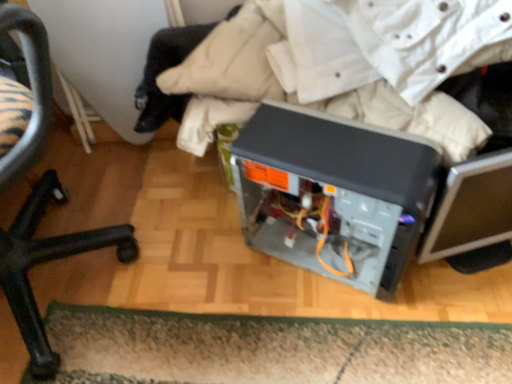
The width and height of the screenshot is (512, 384). Find the location of `black plastic chair at lower left`. black plastic chair at lower left is located at coordinates (47, 261).

Is point (473, 348) closer or farther from the camera than point (28, 215)?

Clearly, point (473, 348) is closer to the camera than point (28, 215).

Is green shaggy doormat at lower center not inside black plastic chair at lower left?

Yes, green shaggy doormat at lower center is outside of black plastic chair at lower left.

Are green shaggy doormat at lower center and black plastic chair at lower left located far from each other?

Actually, green shaggy doormat at lower center and black plastic chair at lower left are a little close together.

How many degrees apart are the facing directions of green shaggy doormat at lower center and black plastic chair at lower left?

The angle between the facing direction of green shaggy doormat at lower center and the facing direction of black plastic chair at lower left is 21.3 degrees.

Between black plastic chair at lower left and satin black computer case at center, which one has smaller width?

satin black computer case at center.

Is black plastic chair at lower left further to camera compared to satin black computer case at center?

No, black plastic chair at lower left is closer to the viewer.

Is black plastic chair at lower left taller or shorter than satin black computer case at center?

black plastic chair at lower left is taller than satin black computer case at center.

Looking at this image, between satin black computer case at center and black plastic chair at lower left, which one appears on the right side from the viewer's perspective?

satin black computer case at center.

Between satin black computer case at center and black plastic chair at lower left, which one is positioned in front?

black plastic chair at lower left is closer to the camera.

From a real-world perspective, is satin black computer case at center under black plastic chair at lower left?

Yes.

Based on the photo, is black plastic chair at lower left positioned beyond the bounds of green shaggy doormat at lower center?

Absolutely, black plastic chair at lower left is external to green shaggy doormat at lower center.

From the image's perspective, relative to green shaggy doormat at lower center, is black plastic chair at lower left above or below?

Based on their image positions, black plastic chair at lower left is located above green shaggy doormat at lower center.

Locate an element on the screen. Image resolution: width=512 pixels, height=384 pixels. chair located above the green shaggy doormat at lower center (from a real-world perspective) is located at coordinates (47, 261).

Would you say green shaggy doormat at lower center contains satin black computer case at center?

That's incorrect, satin black computer case at center is not inside green shaggy doormat at lower center.

Find the location of `wide in front of the green shaggy doormat at lower center`. wide in front of the green shaggy doormat at lower center is located at coordinates (337, 189).

Who is bigger, green shaggy doormat at lower center or satin black computer case at center?

With larger size is satin black computer case at center.

Considering the relative sizes of green shaggy doormat at lower center and satin black computer case at center in the image provided, is green shaggy doormat at lower center shorter than satin black computer case at center?

Correct, green shaggy doormat at lower center is not as tall as satin black computer case at center.

Where is `wide located in front of the green shaggy doormat at lower center`? wide located in front of the green shaggy doormat at lower center is located at coordinates (337, 189).

From the image's perspective, does satin black computer case at center appear lower than green shaggy doormat at lower center?

Incorrect, from the image's perspective, satin black computer case at center is higher than green shaggy doormat at lower center.

Between satin black computer case at center and green shaggy doormat at lower center, which one has smaller width?

With smaller width is green shaggy doormat at lower center.

Is there a large distance between satin black computer case at center and green shaggy doormat at lower center?

satin black computer case at center is near green shaggy doormat at lower center, not far away.

I want to click on chair that is above the green shaggy doormat at lower center (from the image's perspective), so click(x=47, y=261).

This screenshot has height=384, width=512. Identify the location of wide below the black plastic chair at lower left (from a real-world perspective). (337, 189).

Based on the photo, from the image, which object appears to be farther from green shaggy doormat at lower center, satin black computer case at center or black plastic chair at lower left?

black plastic chair at lower left is positioned further to the anchor green shaggy doormat at lower center.

Based on their spatial positions, is satin black computer case at center or green shaggy doormat at lower center closer to black plastic chair at lower left?

green shaggy doormat at lower center.

Considering their positions, is black plastic chair at lower left positioned further to green shaggy doormat at lower center than satin black computer case at center?

Based on the image, black plastic chair at lower left appears to be further to green shaggy doormat at lower center.

When comparing their distances from black plastic chair at lower left, does green shaggy doormat at lower center or satin black computer case at center seem closer?

green shaggy doormat at lower center lies closer to black plastic chair at lower left than the other object.

From the image, which object appears to be nearer to satin black computer case at center, green shaggy doormat at lower center or black plastic chair at lower left?

green shaggy doormat at lower center lies closer to satin black computer case at center than the other object.

Looking at the image, which one is located further to satin black computer case at center, black plastic chair at lower left or green shaggy doormat at lower center?

black plastic chair at lower left.

At what (x,y) coordinates should I click in order to perform the action: click on doormat between black plastic chair at lower left and satin black computer case at center. Please return your answer as a coordinate pair (x, y). Looking at the image, I should click on (270, 348).